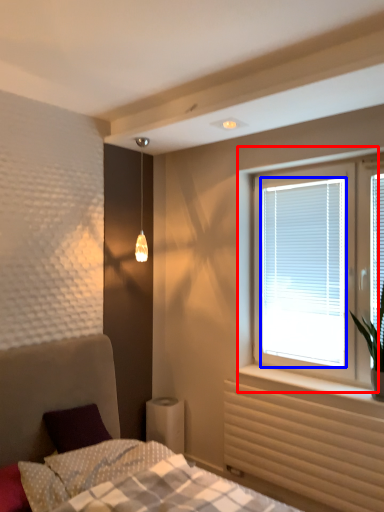
Question: Which object is closer to the camera taking this photo, window (highlighted by a red box) or window screen (highlighted by a blue box)?

Choices:
 (A) window
 (B) window screen

Answer: (A)